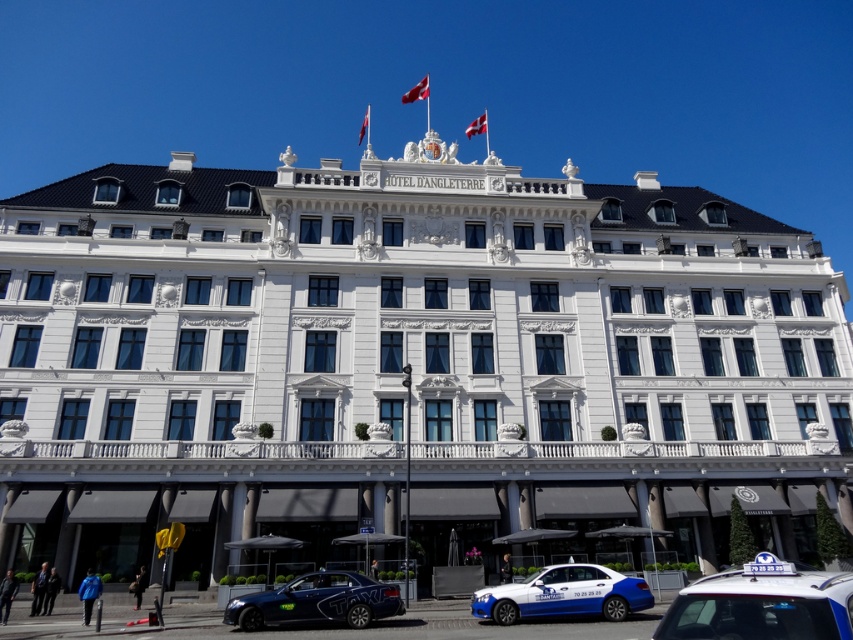
Question: Based on their relative distances, which object is farther from the blue metallic taxi at lower center?

Choices:
 (A) white glossy taxi at lower right
 (B) shiny blue sedan at center

Answer: (A)

Question: Considering the relative positions of blue metallic taxi at lower center and shiny blue sedan at center in the image provided, where is blue metallic taxi at lower center located with respect to shiny blue sedan at center?

Choices:
 (A) above
 (B) below

Answer: (B)

Question: Based on their relative distances, which object is farther from the blue metallic taxi at lower center?

Choices:
 (A) white glossy taxi at lower right
 (B) shiny blue sedan at center

Answer: (A)

Question: Among these objects, which one is nearest to the camera?

Choices:
 (A) shiny blue sedan at center
 (B) white glossy taxi at lower right

Answer: (B)

Question: Does blue metallic taxi at lower center appear on the right side of shiny blue sedan at center?

Choices:
 (A) no
 (B) yes

Answer: (B)

Question: Does blue metallic taxi at lower center appear on the left side of shiny blue sedan at center?

Choices:
 (A) no
 (B) yes

Answer: (A)